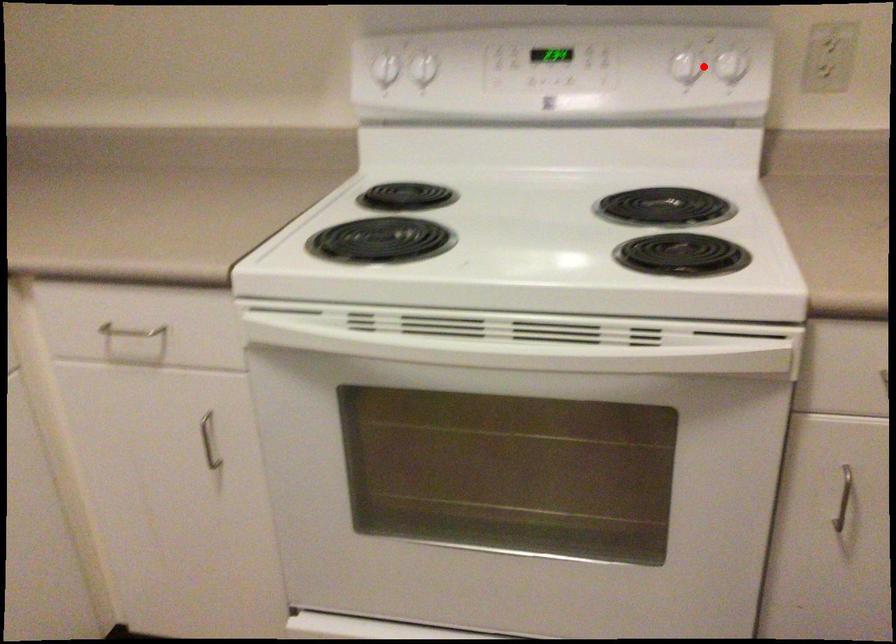
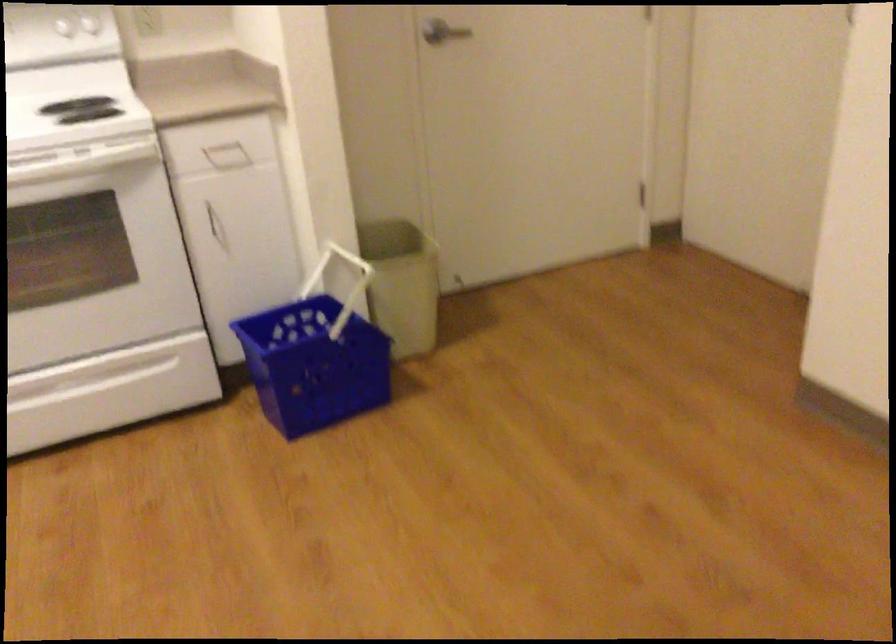
Find the pixel in the second image that matches the highlighted location in the first image.

(80, 26)